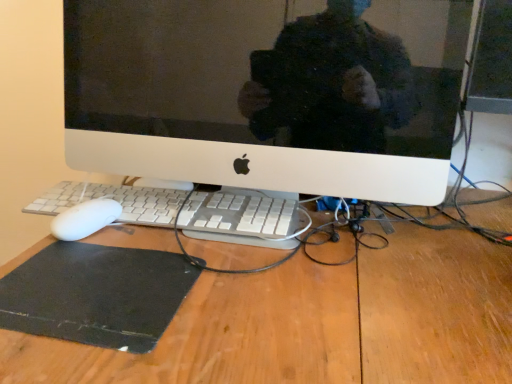
The height and width of the screenshot is (384, 512). Describe the element at coordinates (240, 213) in the screenshot. I see `white plastic keyboard at center` at that location.

What do you see at coordinates (268, 92) in the screenshot? This screenshot has height=384, width=512. I see `white plastic computer monitor at center` at bounding box center [268, 92].

Measure the distance between white plastic computer monitor at center and camera.

white plastic computer monitor at center and camera are 20.73 inches apart.

Find the location of a particular element. white plastic keyboard at center is located at coordinates coord(240,213).

You are a GUI agent. You are given a task and a screenshot of the screen. Output one action in this format:
    pyautogui.click(x=<x>, y=<y>)
    Task: Click on the desk below the black rubber mousepad at lower left (from the image's perspective)
    Image resolution: width=512 pixels, height=384 pixels.
    Given the screenshot: What is the action you would take?
    pyautogui.click(x=318, y=323)

From a real-world perspective, is wooden desk at center positioned over black rubber mousepad at lower left based on gravity?

No, from a real-world perspective, wooden desk at center is not on top of black rubber mousepad at lower left.

Is black rubber mousepad at lower left at the back of wooden desk at center?

wooden desk at center is not turned away from black rubber mousepad at lower left.

Relative to black rubber mousepad at lower left, is wooden desk at center in front or behind?

In the image, wooden desk at center appears in front of black rubber mousepad at lower left.

Consider the image. Can you tell me how much white plastic computer monitor at center and black rubber mousepad at lower left differ in facing direction?

The angle between the facing direction of white plastic computer monitor at center and the facing direction of black rubber mousepad at lower left is 2.08 degrees.

Which is more distant, (197,12) or (113,343)?

The point (197,12) is behind.

In the image, is white plastic computer monitor at center positioned in front of or behind black rubber mousepad at lower left?

Visually, white plastic computer monitor at center is located behind black rubber mousepad at lower left.

How distant is white plastic computer monitor at center from black rubber mousepad at lower left?

white plastic computer monitor at center and black rubber mousepad at lower left are 25.17 inches apart.

From the image's perspective, which is below, white plastic computer monitor at center or white plastic keyboard at center?

white plastic keyboard at center, from the image's perspective.

Is white plastic computer monitor at center positioned far away from white plastic keyboard at center?

They are positioned close to each other.

Based on the photo, choose the correct answer: Is white plastic computer monitor at center inside white plastic keyboard at center or outside it?

The correct answer is: outside.

In the scene shown: Is white plastic computer monitor at center taller than white plastic keyboard at center?

Correct, white plastic computer monitor at center is much taller as white plastic keyboard at center.

Is white plastic computer monitor at center far from wooden desk at center?

No, white plastic computer monitor at center is not far away from wooden desk at center.

From a real-world perspective, who is located higher, white plastic computer monitor at center or wooden desk at center?

white plastic computer monitor at center is physically above.

From the picture: Which object is positioned more to the right, white plastic computer monitor at center or wooden desk at center?

wooden desk at center is more to the right.

Measure the distance from white plastic computer monitor at center to wooden desk at center.

white plastic computer monitor at center is 16.96 inches away from wooden desk at center.

How distant is white plastic keyboard at center from white plastic computer monitor at center?

The distance of white plastic keyboard at center from white plastic computer monitor at center is 16.69 inches.

Where is `computer keyboard on the left of white plastic computer monitor at center`? The height and width of the screenshot is (384, 512). computer keyboard on the left of white plastic computer monitor at center is located at coordinates tap(240, 213).

Are white plastic keyboard at center and white plastic computer monitor at center far apart?

No, white plastic keyboard at center is in close proximity to white plastic computer monitor at center.

From their relative heights in the image, would you say white plastic keyboard at center is taller or shorter than white plastic computer monitor at center?

white plastic keyboard at center is shorter than white plastic computer monitor at center.

Is black rubber mousepad at lower left oriented away from white plastic computer monitor at center?

Yes.

Can you confirm if black rubber mousepad at lower left is smaller than white plastic computer monitor at center?

Yes, black rubber mousepad at lower left is smaller than white plastic computer monitor at center.

Is black rubber mousepad at lower left not near white plastic computer monitor at center?

black rubber mousepad at lower left is actually quite close to white plastic computer monitor at center.

How different are the orientations of black rubber mousepad at lower left and white plastic computer monitor at center in degrees?

The angular difference between black rubber mousepad at lower left and white plastic computer monitor at center is 2.08 degrees.

Locate an element on the screen. This screenshot has height=384, width=512. mousepad behind the wooden desk at center is located at coordinates (96, 294).

Who is more distant, black rubber mousepad at lower left or wooden desk at center?

Positioned behind is black rubber mousepad at lower left.

Considering the relative sizes of black rubber mousepad at lower left and wooden desk at center in the image provided, is black rubber mousepad at lower left taller than wooden desk at center?

No.

You are a GUI agent. You are given a task and a screenshot of the screen. Output one action in this format:
    pyautogui.click(x=<x>, y=<y>)
    Task: Click on the desk below the black rubber mousepad at lower left (from the image's perspective)
    
    Given the screenshot: What is the action you would take?
    pyautogui.click(x=318, y=323)

The width and height of the screenshot is (512, 384). Identify the location of mousepad on the left side of white plastic computer monitor at center. pos(96,294).

When comparing their distances from wooden desk at center, does white plastic computer monitor at center or white plastic keyboard at center seem closer?

Among the two, white plastic keyboard at center is located nearer to wooden desk at center.

Considering their positions, is black rubber mousepad at lower left positioned further to wooden desk at center than white plastic computer monitor at center?

Among the two, white plastic computer monitor at center is located further to wooden desk at center.

Looking at the image, which one is located closer to white plastic computer monitor at center, black rubber mousepad at lower left or white plastic keyboard at center?

white plastic keyboard at center is positioned closer to the anchor white plastic computer monitor at center.

Looking at the image, which one is located further to white plastic computer monitor at center, white plastic keyboard at center or black rubber mousepad at lower left?

black rubber mousepad at lower left lies further to white plastic computer monitor at center than the other object.

Based on their spatial positions, is black rubber mousepad at lower left or wooden desk at center closer to white plastic computer monitor at center?

wooden desk at center.

Considering their positions, is wooden desk at center positioned further to white plastic computer monitor at center than white plastic keyboard at center?

wooden desk at center lies further to white plastic computer monitor at center than the other object.

Based on their spatial positions, is wooden desk at center or white plastic keyboard at center closer to black rubber mousepad at lower left?

white plastic keyboard at center lies closer to black rubber mousepad at lower left than the other object.

Looking at the image, which one is located further to white plastic keyboard at center, black rubber mousepad at lower left or wooden desk at center?

The object further to white plastic keyboard at center is black rubber mousepad at lower left.

You are a GUI agent. You are given a task and a screenshot of the screen. Output one action in this format:
    pyautogui.click(x=<x>, y=<y>)
    Task: Click on the computer monitor between black rubber mousepad at lower left and white plastic keyboard at center from front to back
    The width and height of the screenshot is (512, 384).
    Given the screenshot: What is the action you would take?
    pyautogui.click(x=268, y=92)

The image size is (512, 384). Identify the location of mousepad between wooden desk at center and white plastic keyboard at center in the front-back direction. (96, 294).

Locate an element on the screen. This screenshot has width=512, height=384. mousepad between white plastic computer monitor at center and wooden desk at center in the vertical direction is located at coordinates click(96, 294).

Find the location of a particular element. The width and height of the screenshot is (512, 384). computer keyboard between white plastic computer monitor at center and wooden desk at center from top to bottom is located at coordinates (240, 213).